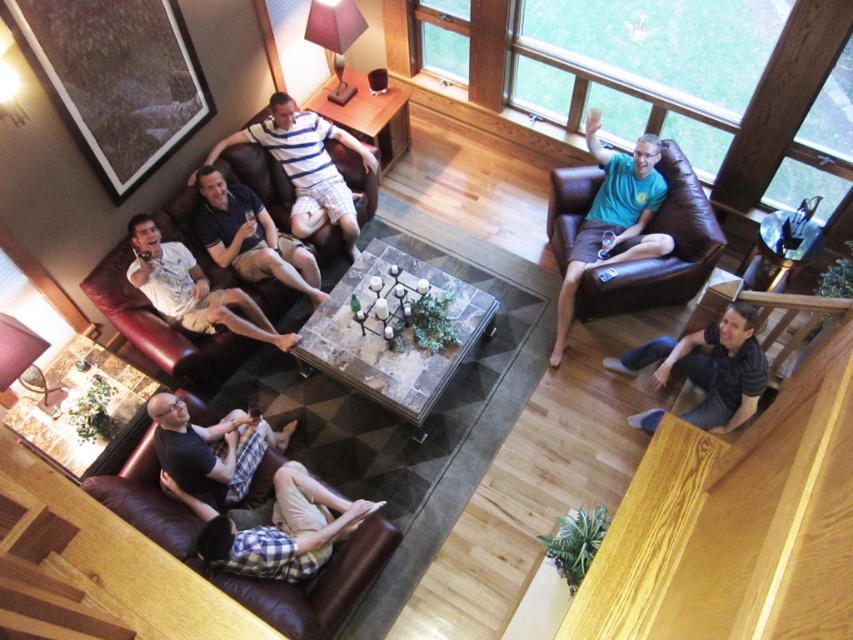
You are planning to place a new plaid fabric shirt at lower left on the brown leather couch at lower left. Will the shirt fit entirely on the couch?

The brown leather couch at lower left is wider than the plaid fabric shirt at lower left, so the shirt will fit entirely on the couch.